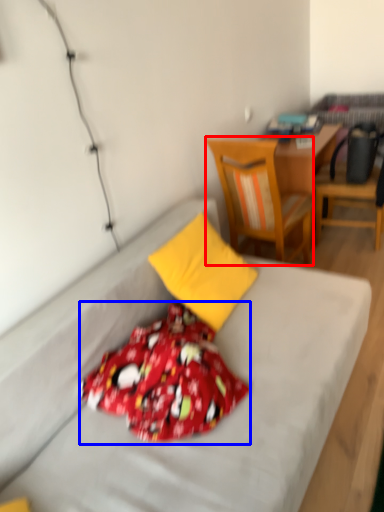
Question: Which object appears closest to the camera in this image, chair (highlighted by a red box) or blanket (highlighted by a blue box)?

Choices:
 (A) chair
 (B) blanket

Answer: (B)